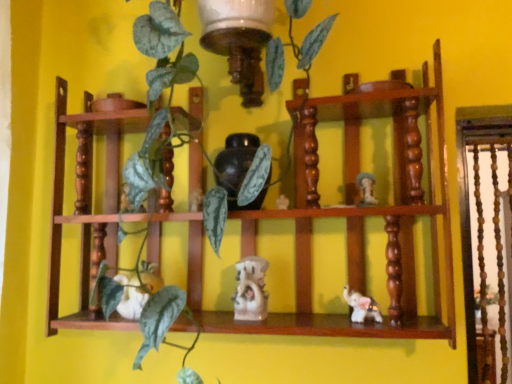
Question: Does white glossy mushroom at upper right, the first toy viewed from the right, have a larger size compared to wooden shelf at center?

Choices:
 (A) no
 (B) yes

Answer: (A)

Question: Considering the relative positions of white glossy mushroom at upper right, positioned as the fourth toy in left-to-right order, and wooden shelf at center in the image provided, is white glossy mushroom at upper right, positioned as the fourth toy in left-to-right order, to the left of wooden shelf at center from the viewer's perspective?

Choices:
 (A) yes
 (B) no

Answer: (B)

Question: Are white glossy mushroom at upper right, the first toy viewed from the right, and wooden shelf at center beside each other?

Choices:
 (A) yes
 (B) no

Answer: (B)

Question: Can wooden shelf at center be found inside white glossy mushroom at upper right, the first toy viewed from the right?

Choices:
 (A) no
 (B) yes

Answer: (A)

Question: Can you confirm if white glossy mushroom at upper right, the first toy viewed from the right, is taller than wooden shelf at center?

Choices:
 (A) yes
 (B) no

Answer: (B)

Question: From the image's perspective, is white glossy mushroom at upper right, the first toy viewed from the right, above wooden shelf at center?

Choices:
 (A) yes
 (B) no

Answer: (A)

Question: Can you confirm if white glossy elephant at lower right, positioned as the third toy in left-to-right order, is taller than white glossy mushroom at upper right, positioned as the fourth toy in left-to-right order?

Choices:
 (A) yes
 (B) no

Answer: (B)

Question: Is white glossy elephant at lower right, positioned as the third toy in left-to-right order, positioned in front of white glossy mushroom at upper right, the first toy viewed from the right?

Choices:
 (A) no
 (B) yes

Answer: (B)

Question: From the image's perspective, is white glossy elephant at lower right, positioned as the second toy in right-to-left order, on white glossy mushroom at upper right, positioned as the fourth toy in left-to-right order?

Choices:
 (A) no
 (B) yes

Answer: (A)

Question: Considering the relative sizes of white glossy elephant at lower right, positioned as the second toy in right-to-left order, and white glossy mushroom at upper right, positioned as the fourth toy in left-to-right order, in the image provided, is white glossy elephant at lower right, positioned as the second toy in right-to-left order, wider than white glossy mushroom at upper right, positioned as the fourth toy in left-to-right order,?

Choices:
 (A) yes
 (B) no

Answer: (B)

Question: Does white glossy elephant at lower right, positioned as the third toy in left-to-right order, have a lesser height compared to white glossy mushroom at upper right, positioned as the fourth toy in left-to-right order?

Choices:
 (A) no
 (B) yes

Answer: (B)

Question: Is white glossy elephant at lower right, positioned as the second toy in right-to-left order, to the right of white glossy mushroom at upper right, the first toy viewed from the right, from the viewer's perspective?

Choices:
 (A) no
 (B) yes

Answer: (A)

Question: From the image's perspective, is white glossy elephant at lower right, positioned as the third toy in left-to-right order, on wooden shelf at center?

Choices:
 (A) yes
 (B) no

Answer: (B)